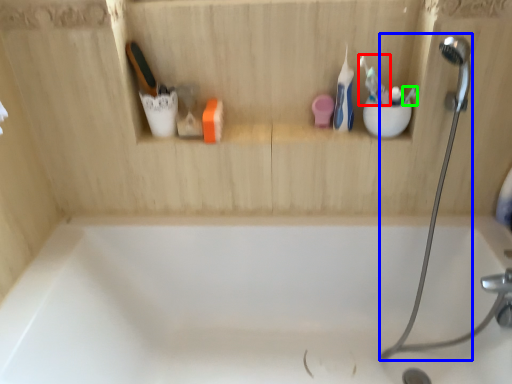
Question: Which is farther away from toothbrush (highlighted by a red box)? shower (highlighted by a blue box) or toothbrush (highlighted by a green box)?

Choices:
 (A) shower
 (B) toothbrush

Answer: (A)